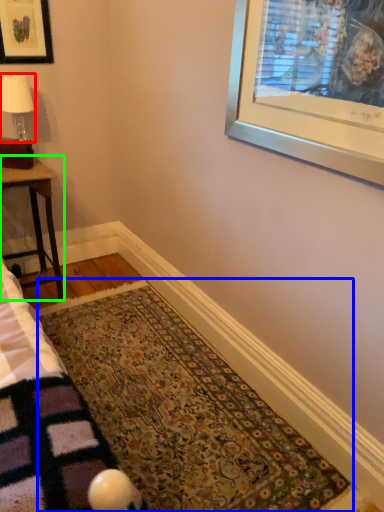
Question: Which is nearer to the lamp (highlighted by a red box)? mat (highlighted by a blue box) or table (highlighted by a green box).

Choices:
 (A) mat
 (B) table

Answer: (B)